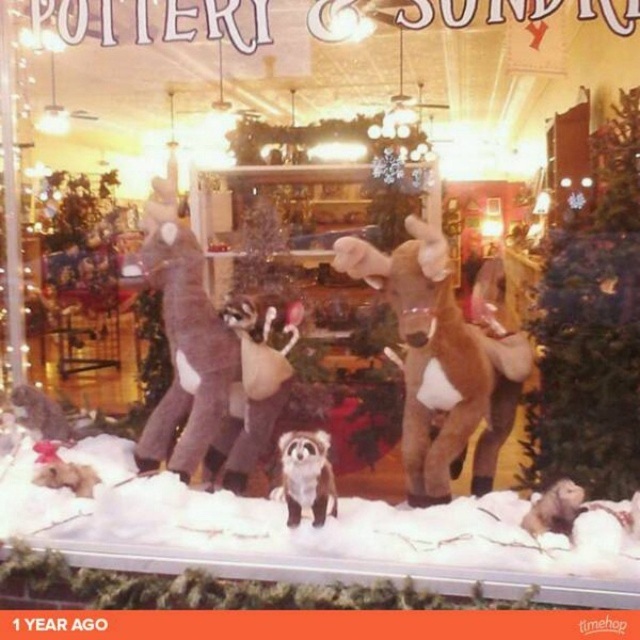
You are standing in front of the store window and want to touch the two points marked in the display. Which point, point (333, 500) or point (524, 520), is closer to your hand when you reach out?

Point (333, 500) is closer to your hand because it is further to the camera than point (524, 520), meaning it is physically nearer to the observer.

You are a store employee checking the holiday display. You need to place a new golden star ornament on top of the tallest object in the display. Which object should you choose between the white fluffy snow at center and the brown plush reindeer at center?

The white fluffy snow at center has a larger size compared to the brown plush reindeer at center, so the tallest object is the white fluffy snow at center. You should place the golden star ornament on top of the white fluffy snow at center.